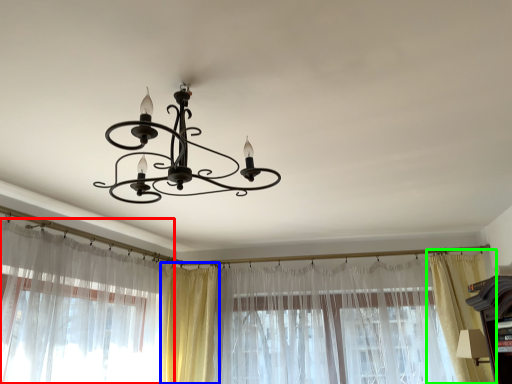
Question: Which object is the farthest from curtain (highlighted by a red box)? Choose among these: curtain (highlighted by a blue box) or curtain (highlighted by a green box).

Choices:
 (A) curtain
 (B) curtain

Answer: (B)